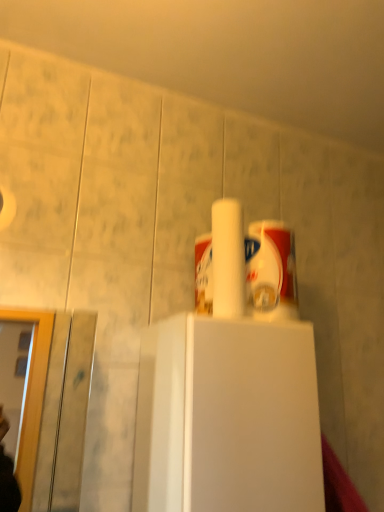
Image resolution: width=384 pixels, height=512 pixels. What do you see at coordinates (228, 259) in the screenshot?
I see `white matte paper towel at center` at bounding box center [228, 259].

The height and width of the screenshot is (512, 384). Find the location of `white matte paper towel at center`. white matte paper towel at center is located at coordinates (228, 259).

You are a GUI agent. You are given a task and a screenshot of the screen. Output one action in this format:
    pyautogui.click(x=<x>, y=<y>)
    Task: Click on the white matte paper towel at center
    The image size is (384, 512).
    Given the screenshot: What is the action you would take?
    pyautogui.click(x=228, y=259)